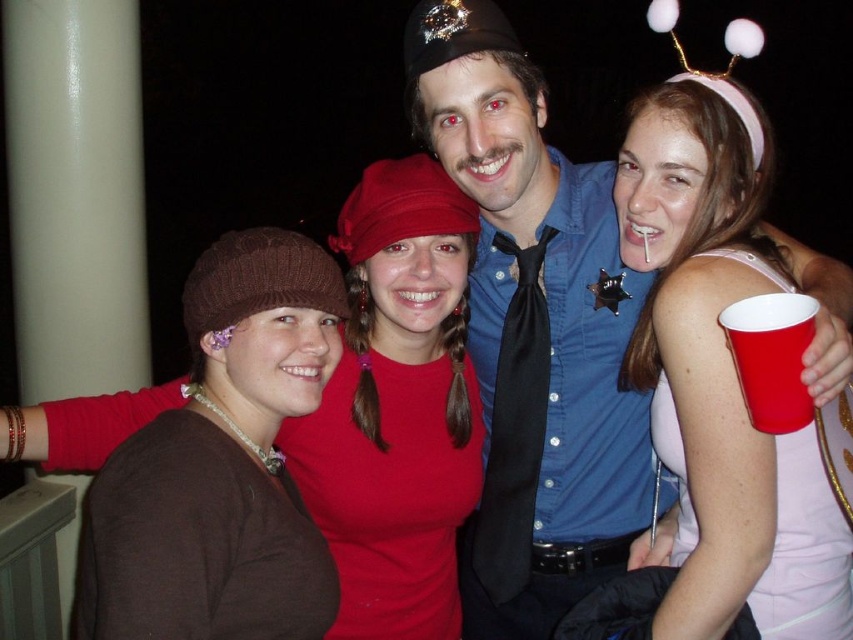
Between blue shirt at center and brown knit beanie at left, which one has less height?

brown knit beanie at left is shorter.

Is blue shirt at center positioned at the back of brown knit beanie at left?

That is False.

The image size is (853, 640). Find the location of `blue shirt at center`. blue shirt at center is located at coordinates (532, 328).

Who is positioned more to the right, blue shirt at center or pink satin dress at center?

pink satin dress at center

Which of these two, blue shirt at center or pink satin dress at center, stands taller?

With more height is blue shirt at center.

Between point (556, 282) and point (660, 324), which one is positioned in front?

Point (660, 324) is more forward.

Identify the location of blue shirt at center. The width and height of the screenshot is (853, 640). (532, 328).

Who is positioned more to the right, pink satin dress at center or brown knit beanie at left?

pink satin dress at center is more to the right.

Is point (676, 144) more distant than point (358, 534)?

No.

I want to click on pink satin dress at center, so tap(721, 376).